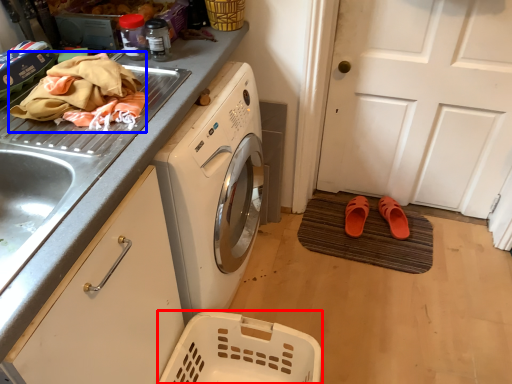
Question: Which of the following is the farthest to the observer, basket (highlighted by a red box) or material (highlighted by a blue box)?

Choices:
 (A) basket
 (B) material

Answer: (A)